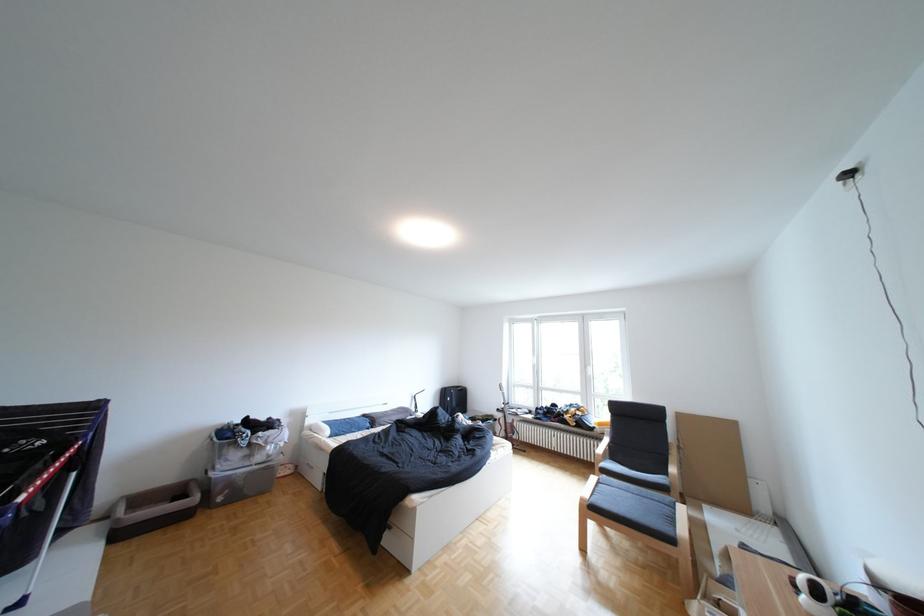
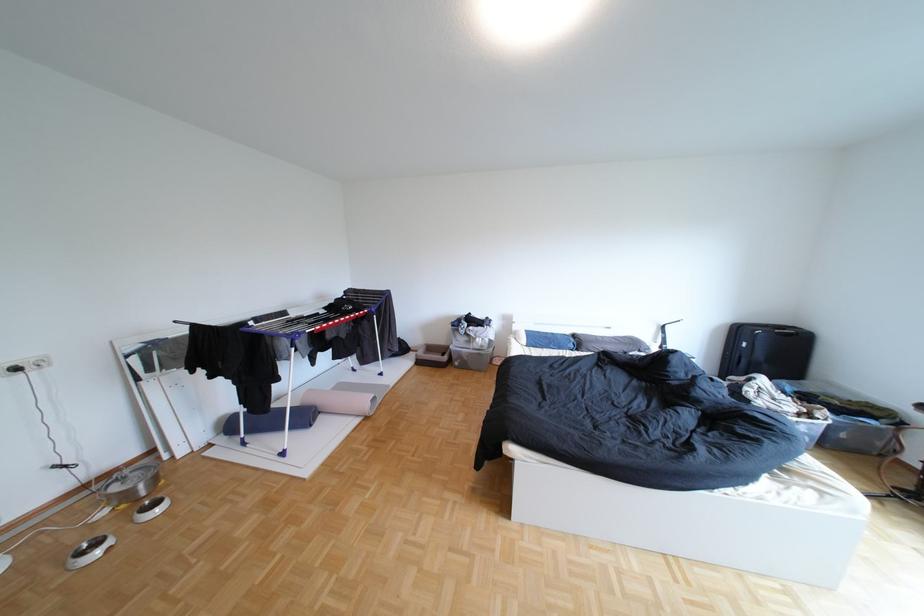
Locate, in the second image, the point that corresponds to point (380, 416) in the first image.

(590, 336)